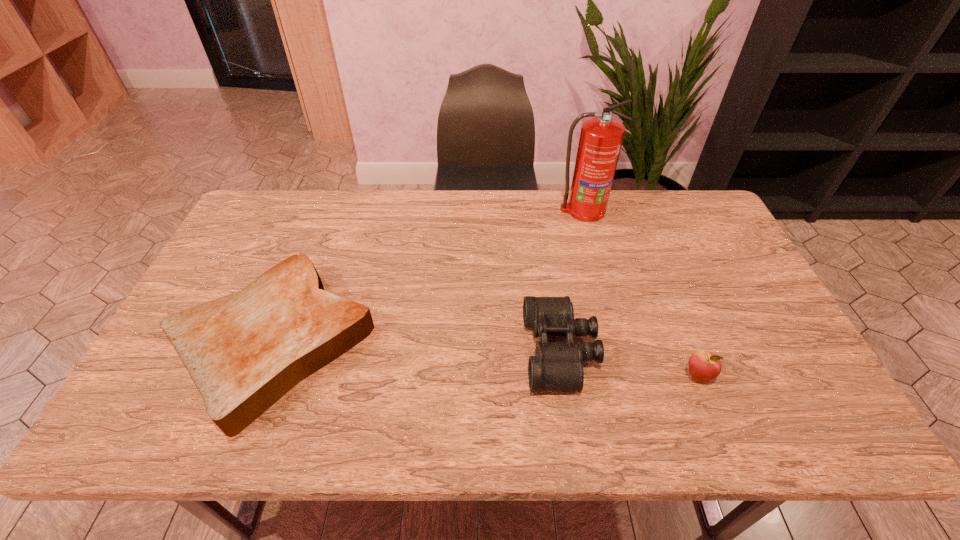
You are a GUI agent. You are given a task and a screenshot of the screen. Output one action in this format:
    pyautogui.click(x=<x>, y=<y>)
    Task: Click on the farthest object
    The height and width of the screenshot is (540, 960).
    Given the screenshot: What is the action you would take?
    pyautogui.click(x=601, y=137)

What are the coordinates of `the tallest object` in the screenshot? It's located at (601, 137).

Locate an element on the screen. binoculars is located at coordinates (558, 366).

Image resolution: width=960 pixels, height=540 pixels. In order to click on the rightmost object in this screenshot , I will do `click(704, 366)`.

Find the location of a particular element. Image resolution: width=960 pixels, height=540 pixels. the shortest object is located at coordinates (244, 351).

Locate an element on the screen. the leftmost object is located at coordinates (244, 351).

The width and height of the screenshot is (960, 540). Identify the location of blank space located on the instruction side of the tallest object. (611, 313).

Locate an element on the screen. Image resolution: width=960 pixels, height=540 pixels. free space located 0.180m at the eyepieces of the binoculars is located at coordinates (455, 351).

Find the location of a particular element. This screenshot has height=540, width=960. blank space located at the eyepieces of the binoculars is located at coordinates (403, 351).

Find the location of a particular element. Image resolution: width=960 pixels, height=540 pixels. free space located 0.290m at the eyepieces of the binoculars is located at coordinates (411, 351).